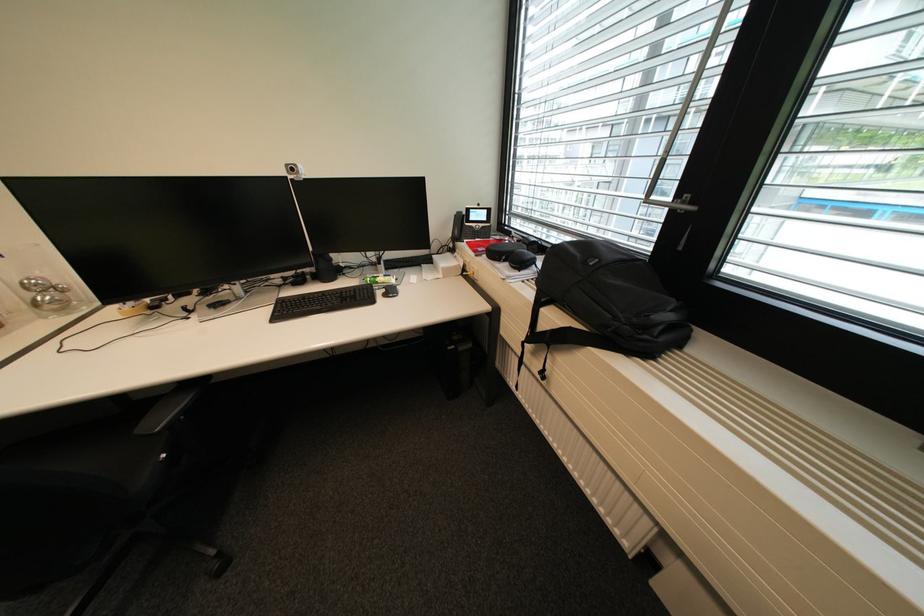
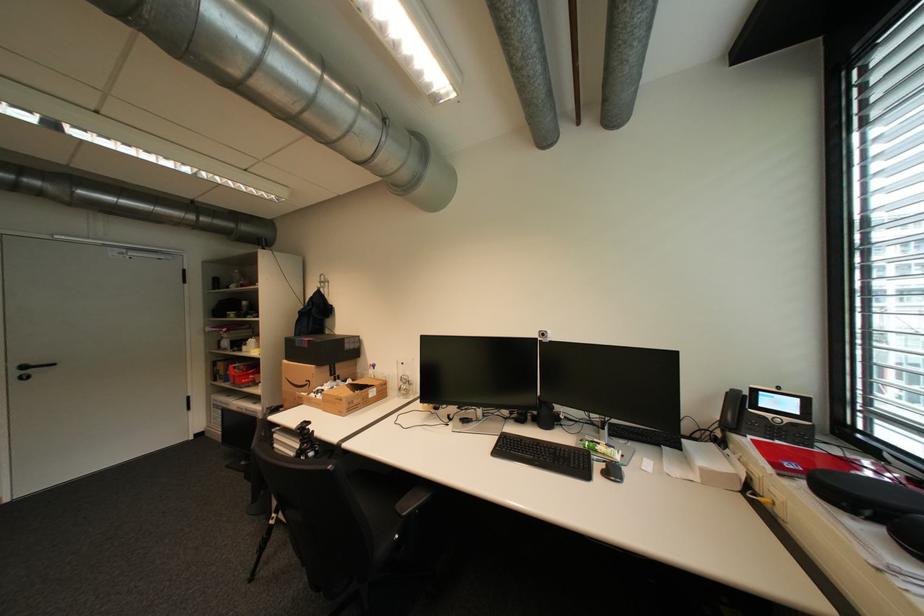
Locate, in the second image, the point that corresponds to the point at 493,220 in the first image.

(806, 413)